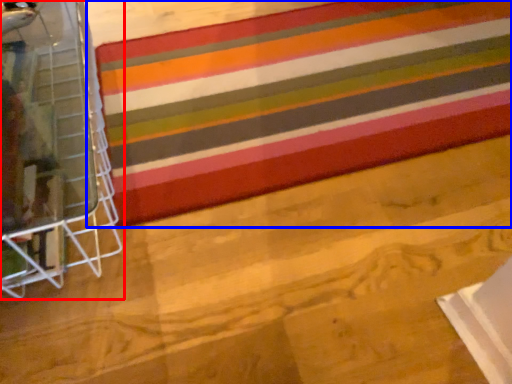
Question: Which of the following is the closest to the observer, furniture (highlighted by a red box) or quilt (highlighted by a blue box)?

Choices:
 (A) furniture
 (B) quilt

Answer: (A)